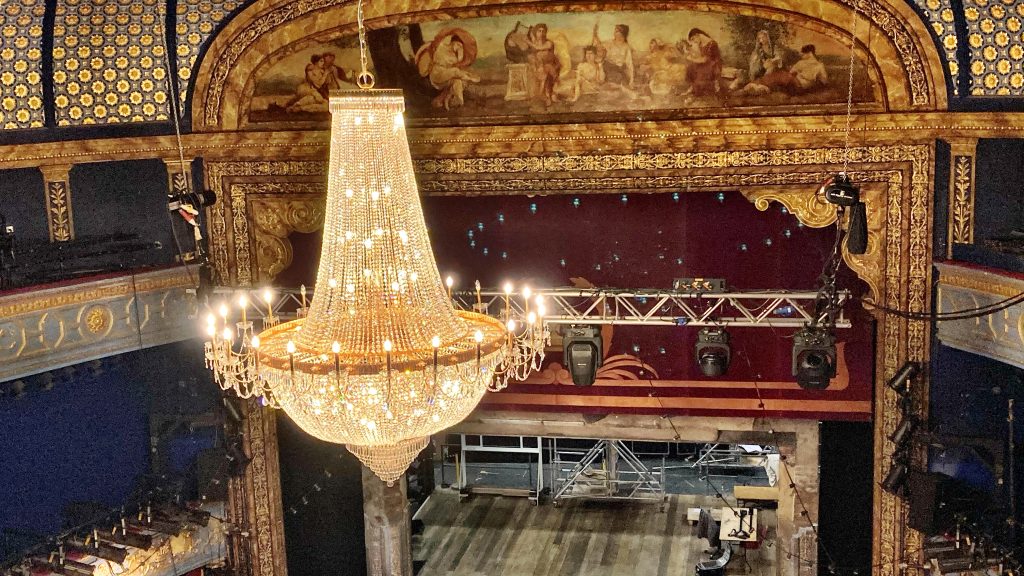
Locate an element on the screen. This screenshot has height=576, width=1024. painting is located at coordinates (468, 52), (596, 59), (764, 60), (308, 68).